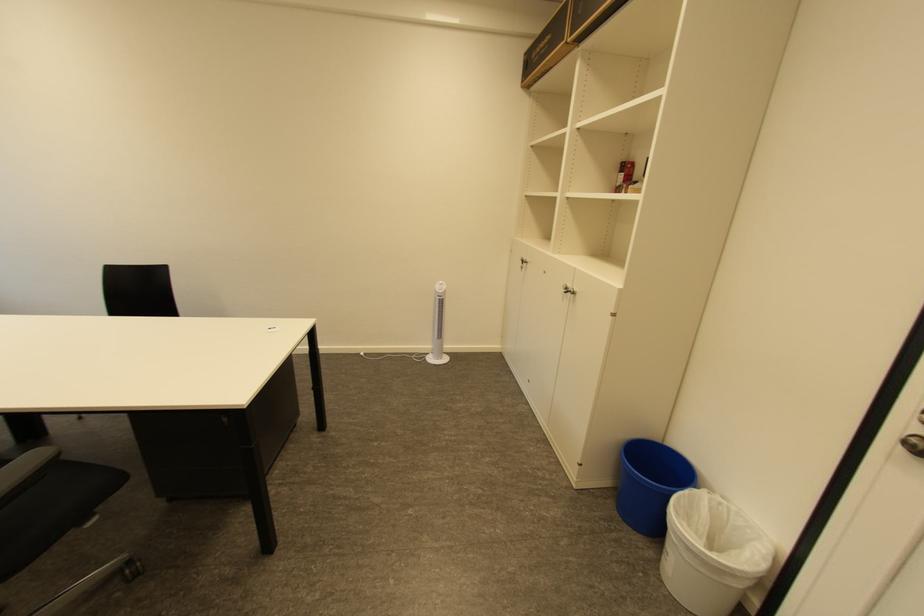
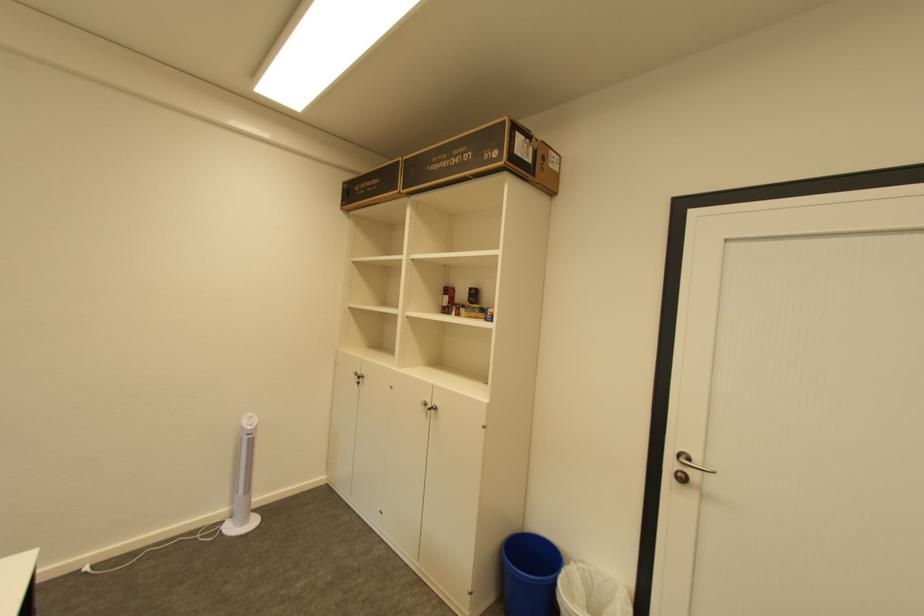
Question: The images are taken continuously from a first-person perspective. In which direction is your viewpoint rotating?

Choices:
 (A) Left
 (B) Right
 (C) Up
 (D) Down

Answer: (B)